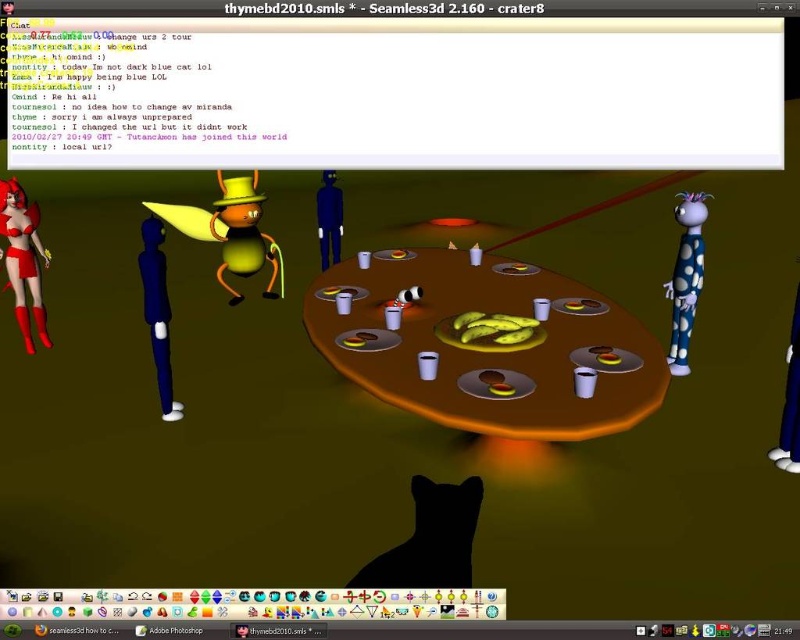
Which is more to the right, brown wooden table at center or black matte cat at lower center?

brown wooden table at center is more to the right.

Is brown wooden table at center to the right of black matte cat at lower center from the viewer's perspective?

Correct, you'll find brown wooden table at center to the right of black matte cat at lower center.

Where is `brown wooden table at center`? The width and height of the screenshot is (800, 640). brown wooden table at center is located at coordinates (486, 344).

Who is more forward, (688, 65) or (486, 410)?

Point (688, 65)

Is transparent plastic chat window at upper center bigger than brown wooden table at center?

No.

You are a GUI agent. You are given a task and a screenshot of the screen. Output one action in this format:
    pyautogui.click(x=<x>, y=<y>)
    Task: Click on the transparent plastic chat window at upper center
    The image size is (800, 640).
    Given the screenshot: What is the action you would take?
    pyautogui.click(x=394, y=92)

Is transparent plastic chat window at upper center taller than black matte cat at lower center?

Yes, transparent plastic chat window at upper center is taller than black matte cat at lower center.

Who is lower down, transparent plastic chat window at upper center or black matte cat at lower center?

black matte cat at lower center is lower down.

I want to click on transparent plastic chat window at upper center, so click(394, 92).